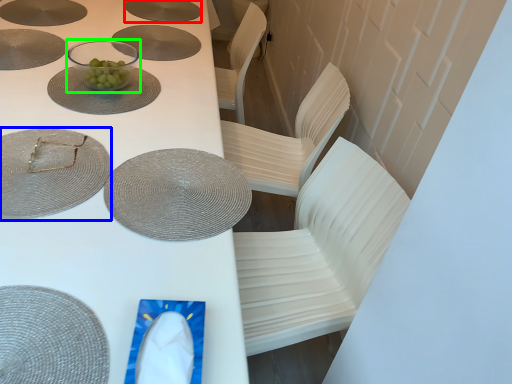
Question: Estimate the real-world distances between objects in this image. Which object is farther from platter (highlighted by a red box), glass plate (highlighted by a blue box) or tableware (highlighted by a green box)?

Choices:
 (A) glass plate
 (B) tableware

Answer: (A)